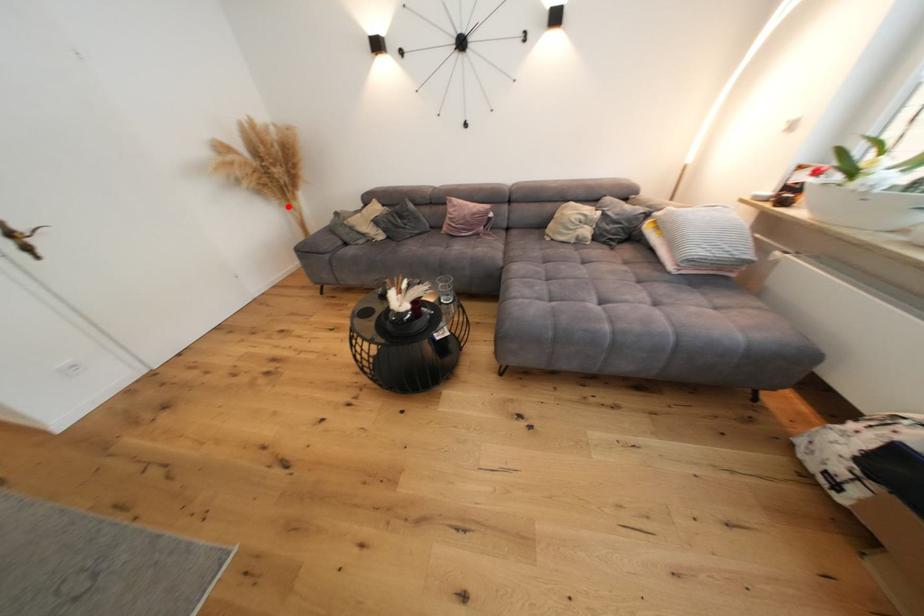
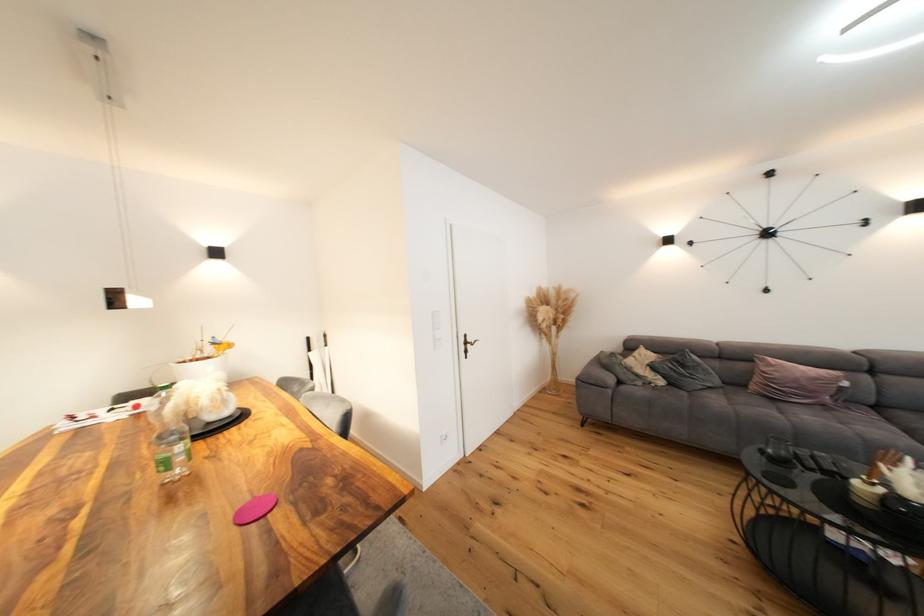
Locate, in the second image, the point that corresponds to the highlighted location in the first image.

(548, 342)